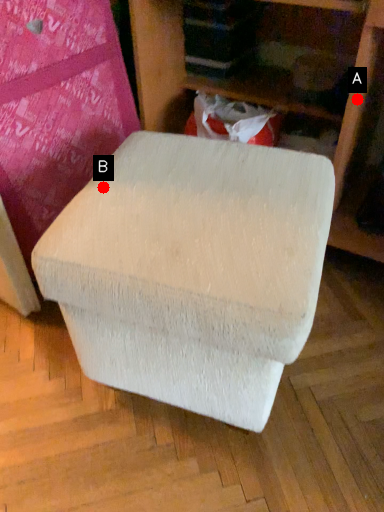
Question: Two points are circled on the image, labeled by A and B beside each circle. Which point is closer to the camera?

Choices:
 (A) A is closer
 (B) B is closer

Answer: (B)